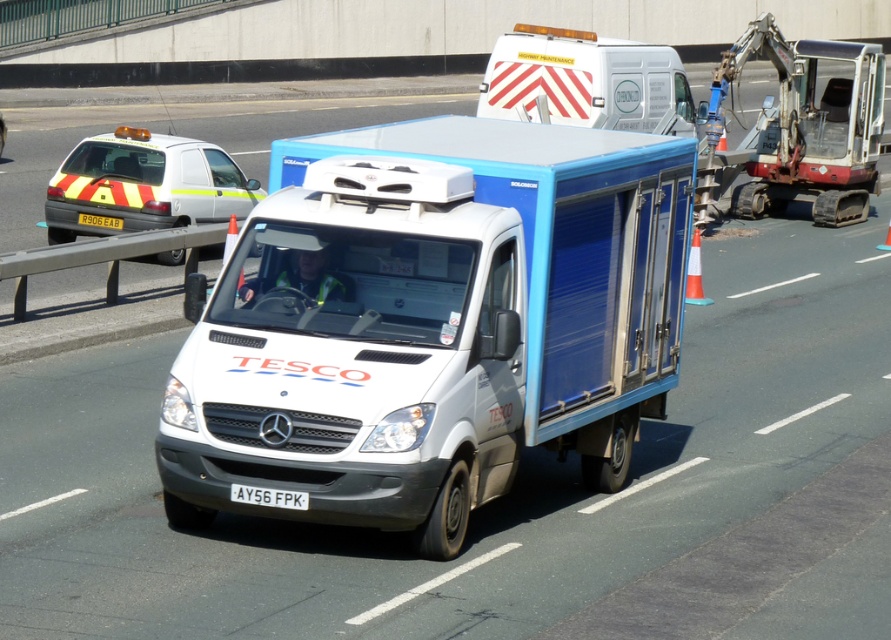
Is white glossy van at center smaller than white glossy ambulance at upper center?

No, white glossy van at center is not smaller than white glossy ambulance at upper center.

Who is positioned more to the right, white glossy van at center or white glossy ambulance at upper center?

white glossy ambulance at upper center

Describe the element at coordinates (431, 323) in the screenshot. I see `white glossy van at center` at that location.

Locate an element on the screen. white glossy van at center is located at coordinates (431, 323).

Who is lower down, white plastic excavator at upper right or white glossy ambulance at upper center?

white plastic excavator at upper right

Based on the photo, who is positioned more to the left, white plastic excavator at upper right or white glossy ambulance at upper center?

From the viewer's perspective, white glossy ambulance at upper center appears more on the left side.

Is point (771, 35) closer to camera compared to point (581, 92)?

No, it is behind (581, 92).

This screenshot has width=891, height=640. In order to click on white plastic excavator at upper right in this screenshot , I will do `click(808, 124)`.

Who is taller, white glossy van at center or yellow and black striped taxi at left?

With more height is white glossy van at center.

Is point (442, 481) less distant than point (86, 196)?

Yes, point (442, 481) is closer to viewer.

I want to click on white glossy van at center, so click(431, 323).

Locate an element on the screen. white glossy van at center is located at coordinates (431, 323).